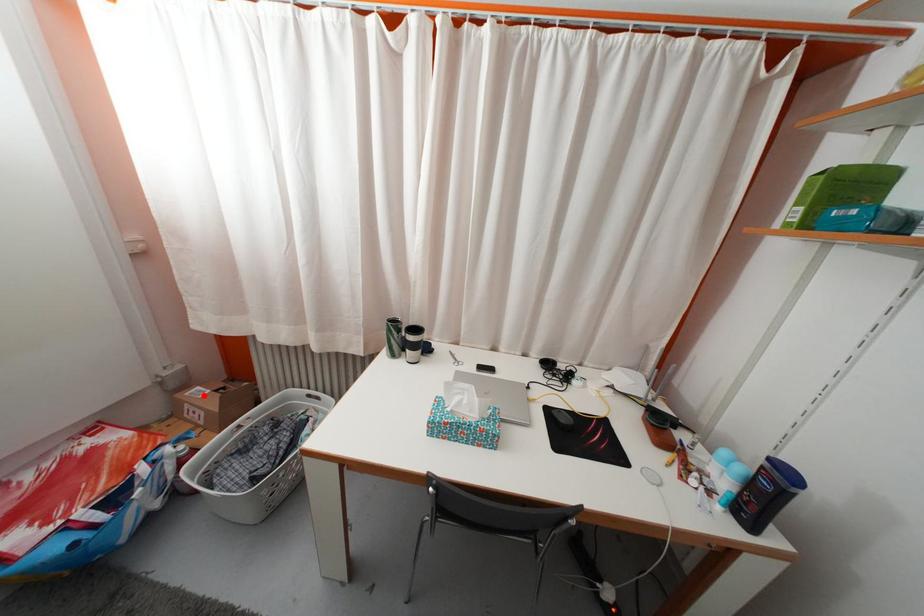
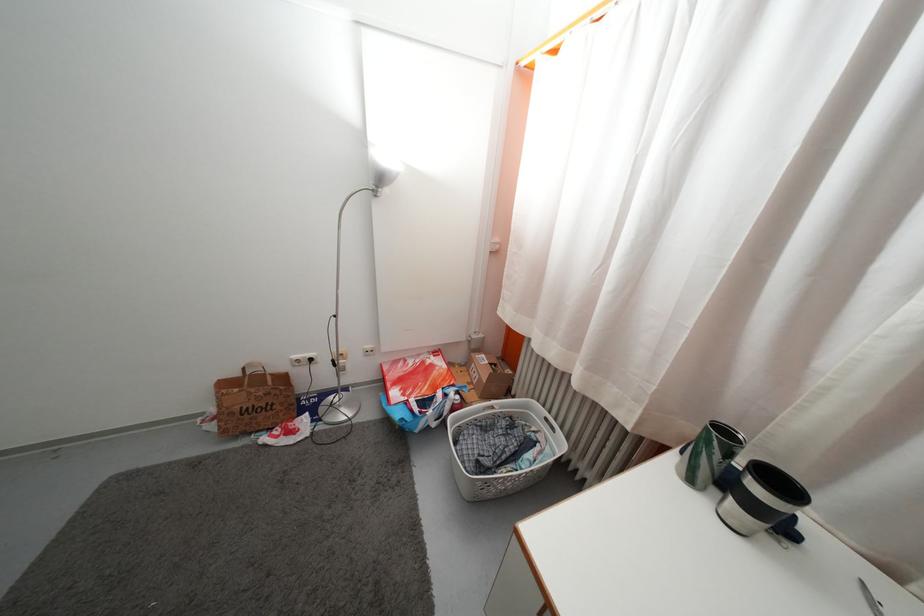
Question: I am providing you with two images of the same scene from different viewpoints. A red point is shown in image1. For the corresponding object point in image2, is it positioned nearer or farther from the camera?

Choices:
 (A) Nearer
 (B) Farther

Answer: (B)